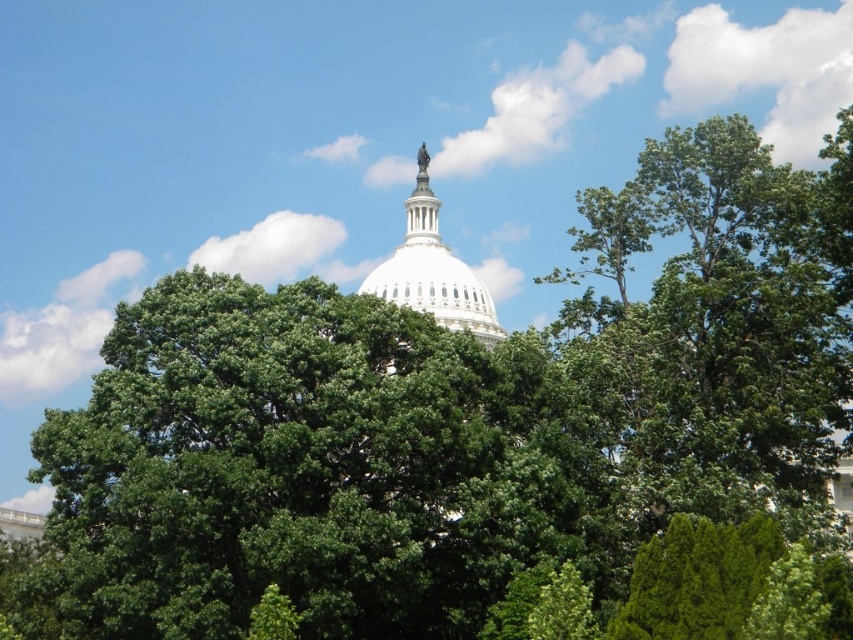
You are standing in front of the United States Capitol Building and notice a green leafy tree at upper right. Where exactly is the green leafy tree at upper right located in relation to the point marked at coordinates (732, 314)?

The green leafy tree at upper right is located exactly at the point marked at coordinates (732, 314).

You are a photographer planning to capture the United States Capitol Building. You notice the green leafy tree at upper right and the white marble dome at center. Based on their widths, which object might block the view of the other when framing your shot?

The green leafy tree at upper right might be wider than the white marble dome at center, so it could potentially block the dome if positioned in front or overlapping in the frame.